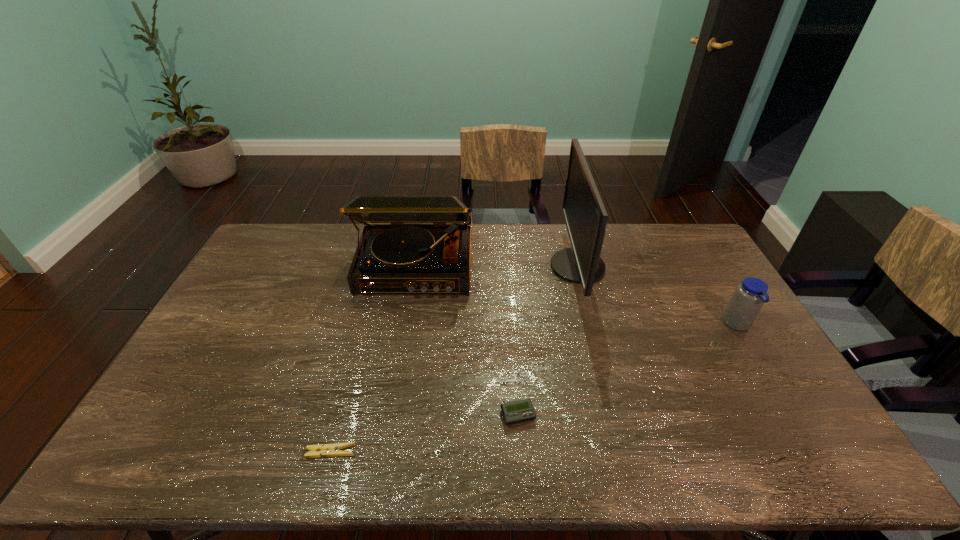
You are a GUI agent. You are given a task and a screenshot of the screen. Output one action in this format:
    pyautogui.click(x=<x>, y=<y>)
    Task: Click on the tallest object
    The image size is (960, 540).
    Given the screenshot: What is the action you would take?
    pyautogui.click(x=585, y=216)

The height and width of the screenshot is (540, 960). Find the location of `monitor`. monitor is located at coordinates (585, 216).

Find the location of a particular element. the second tallest object is located at coordinates (410, 244).

Where is `the third tallest object`? the third tallest object is located at coordinates (749, 296).

You are a GUI agent. You are given a task and a screenshot of the screen. Output one action in this format:
    pyautogui.click(x=<x>, y=<y>)
    Task: Click on the water bottle
    
    Given the screenshot: What is the action you would take?
    click(749, 296)

Identify the location of the fourth farthest object. (514, 412).

You are a GUI agent. You are given a task and a screenshot of the screen. Output one action in this format:
    pyautogui.click(x=<x>, y=<y>)
    Task: Click on the third object from right to left
    Image resolution: width=960 pixels, height=540 pixels.
    Given the screenshot: What is the action you would take?
    pyautogui.click(x=514, y=412)

Locate an element on the screen. the shortest object is located at coordinates (328, 450).

Where is `clothespin`? The height and width of the screenshot is (540, 960). clothespin is located at coordinates (328, 450).

Where is `blank space located 0.220m on the screen side of the monitor`? blank space located 0.220m on the screen side of the monitor is located at coordinates (490, 266).